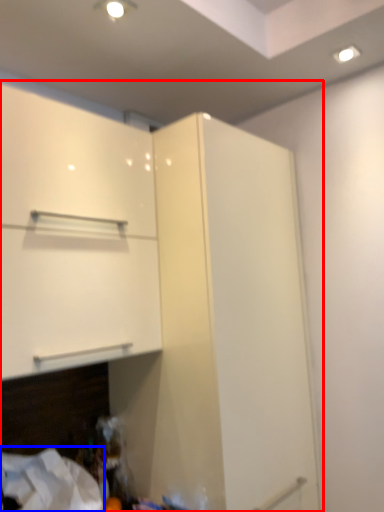
Question: Which point is closer to the camera, cupboard (highlighted by a red box) or sheet (highlighted by a blue box)?

Choices:
 (A) cupboard
 (B) sheet

Answer: (A)